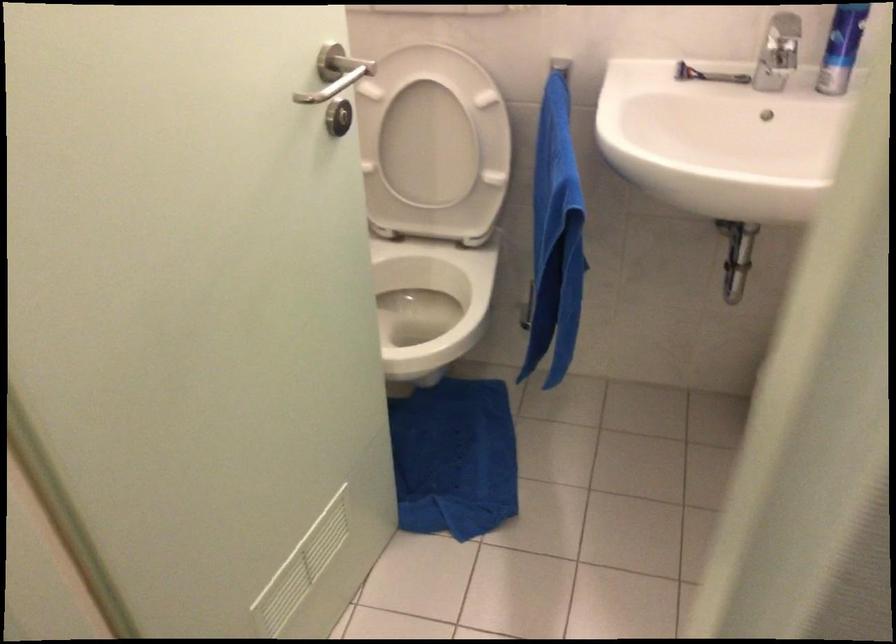
In order to click on metal door handle in this screenshot , I will do `click(332, 62)`.